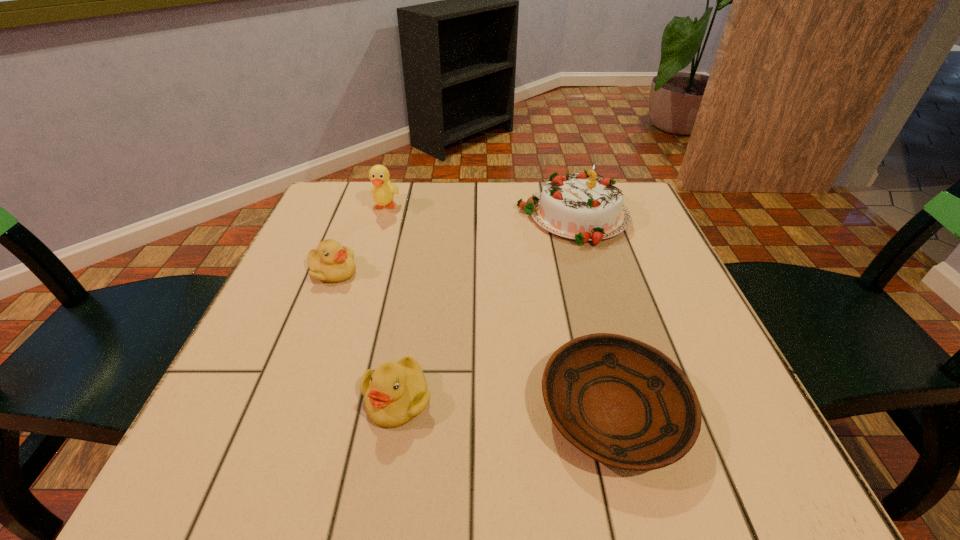
The width and height of the screenshot is (960, 540). In order to click on cake that is at the far edge in this screenshot , I will do `click(582, 206)`.

Image resolution: width=960 pixels, height=540 pixels. I want to click on duckling positioned at the far edge, so click(383, 191).

Find the location of a particular element. This screenshot has width=960, height=540. duckling present at the near edge is located at coordinates (396, 392).

The width and height of the screenshot is (960, 540). In order to click on plate that is positioned at the near edge in this screenshot , I will do `click(620, 401)`.

The width and height of the screenshot is (960, 540). I want to click on cake situated at the right edge, so click(x=582, y=206).

In order to click on plate that is at the right edge in this screenshot , I will do `click(620, 401)`.

Find the location of a particular element. The image size is (960, 540). object that is at the far left corner is located at coordinates (383, 191).

You are a GUI agent. You are given a task and a screenshot of the screen. Output one action in this format:
    pyautogui.click(x=<x>, y=<y>)
    Task: Click on the object located in the far right corner section of the desktop
    The image size is (960, 540).
    Given the screenshot: What is the action you would take?
    pyautogui.click(x=582, y=206)

You are a GUI agent. You are given a task and a screenshot of the screen. Output one action in this format:
    pyautogui.click(x=<x>, y=<y>)
    Task: Click on the object present at the near right corner
    The width and height of the screenshot is (960, 540).
    Given the screenshot: What is the action you would take?
    click(620, 401)

In the image, there is a desktop. At what (x,y) coordinates should I click in order to perform the action: click on vacant area at the far edge. Please return your answer as a coordinate pair (x, y). The height and width of the screenshot is (540, 960). Looking at the image, I should click on (453, 203).